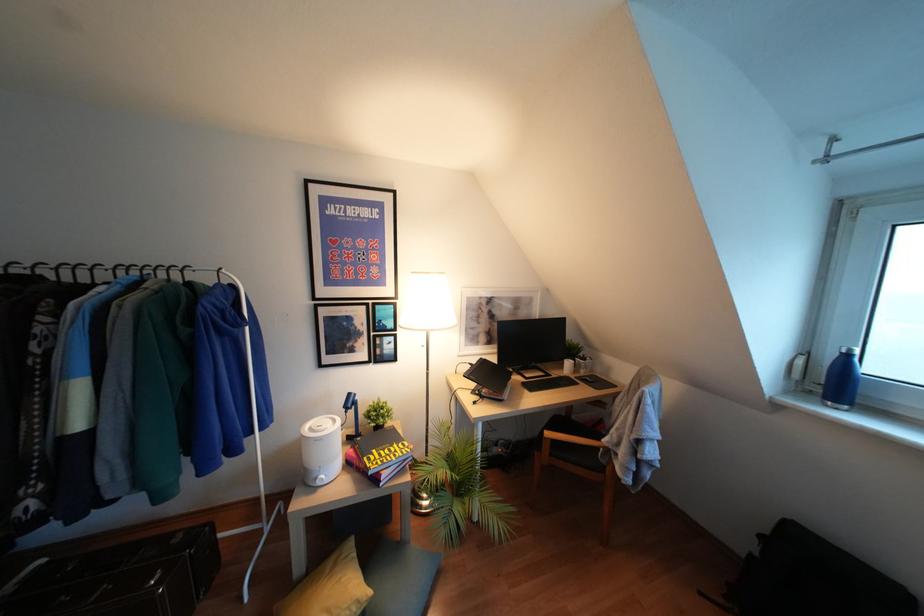
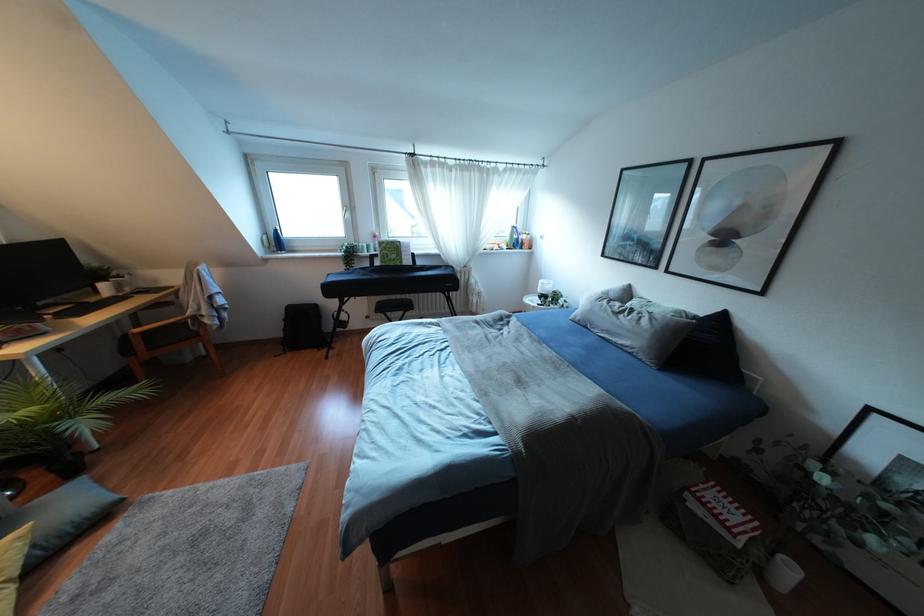
Locate, in the second image, the point that corresponds to (833,379) in the first image.

(275, 241)